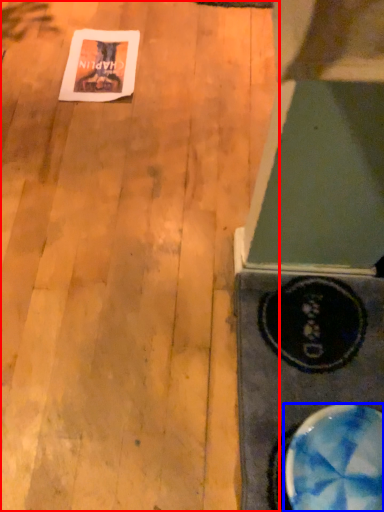
Question: Among these objects, which one is farthest to the camera, plywood (highlighted by a red box) or bowl (highlighted by a blue box)?

Choices:
 (A) plywood
 (B) bowl

Answer: (A)